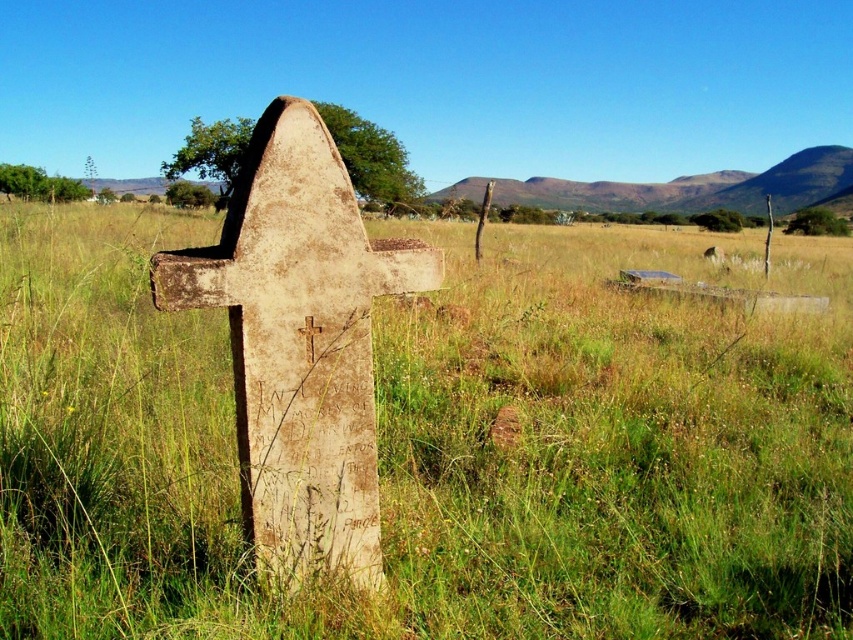
Which is more to the right, weathered stone cross at center or golden textured cross at center?

golden textured cross at center

Which is in front, point (799, 353) or point (306, 355)?

Point (306, 355) is in front.

Image resolution: width=853 pixels, height=640 pixels. I want to click on weathered stone cross at center, so click(434, 445).

Identify the location of weathered stone cross at center. coord(434,445).